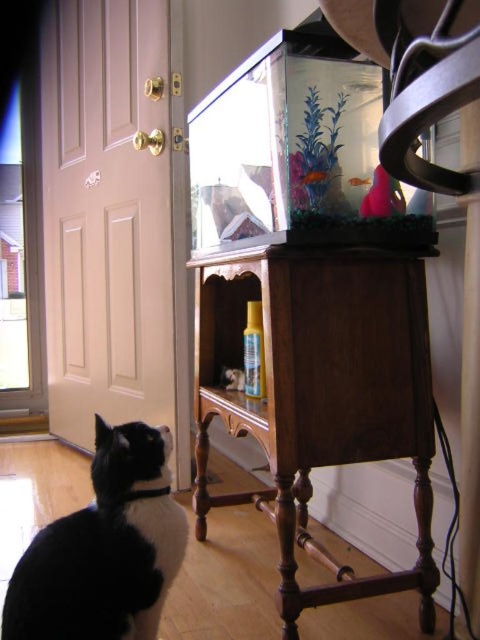
You are a small toy mouse. You want to roll from the wooden at center to the pink matte fish at upper center without being seen by the cat. Can you do it? Explain why.

The wooden at center is in front of the pink matte fish at upper center, so the wooden at center blocks the path between them. The toy mouse cannot roll from the wooden at center to the pink matte fish at upper center without being seen by the cat because the wooden object is in the way.

You are a small toy car that is 10 cm wide. You want to move from the wooden at center to the pink matte fish at upper center. Is there enough space between them for you to pass through?

The wooden at center is wider than the pink matte fish at upper center, but the question of space between them isn